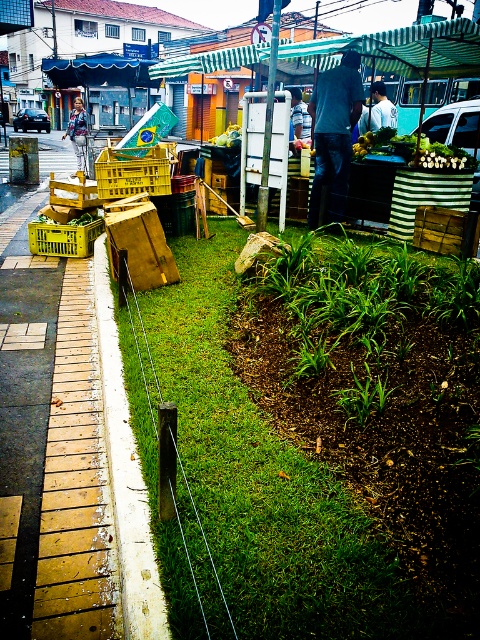
Question: Which object is positioned farthest from the white shirt at center?

Choices:
 (A) yellow plastic crate at center-left
 (B) yellow plastic crate at lower left
 (C) yellow painted concrete pavement at left
 (D) yellow plastic crate at center

Answer: (C)

Question: Does green grass at center have a greater width compared to denim jacket at upper left?

Choices:
 (A) no
 (B) yes

Answer: (A)

Question: Is white shirt at center above denim jacket at upper left?

Choices:
 (A) yes
 (B) no

Answer: (B)

Question: Considering the relative positions of yellow painted concrete pavement at left and yellow plastic crate at center in the image provided, where is yellow painted concrete pavement at left located with respect to yellow plastic crate at center?

Choices:
 (A) below
 (B) above

Answer: (A)

Question: Considering the real-world distances, which object is closest to the green leafy produce at center?

Choices:
 (A) dark blue shirt at center
 (B) yellow plastic crate at lower left

Answer: (A)

Question: Which is nearer to the denim jacket at upper left?

Choices:
 (A) dark blue shirt at center
 (B) yellow painted concrete pavement at left

Answer: (A)